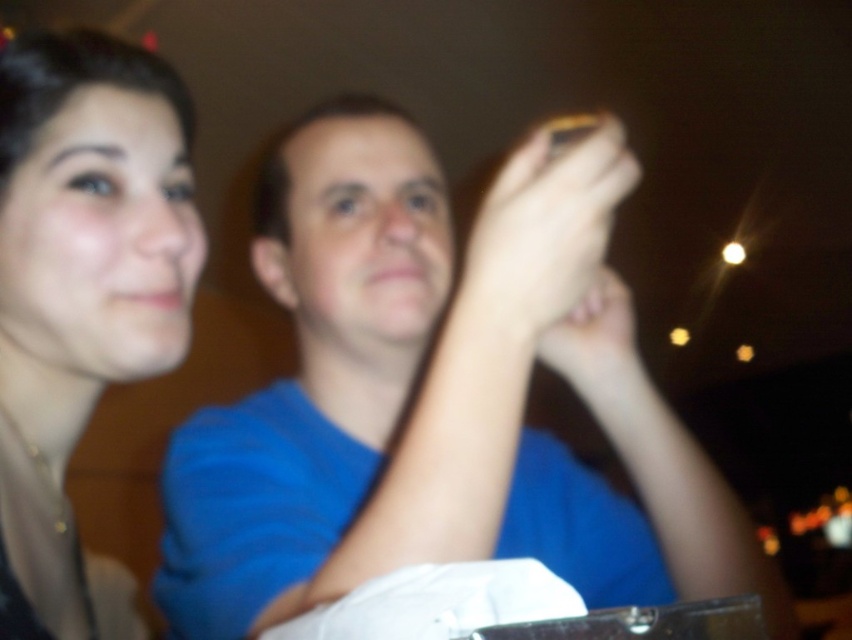
Question: Which is nearer to the smooth skin at upper center?

Choices:
 (A) yellow matte phone at upper center
 (B) blue matte shirt at center
 (C) matte black hair at upper left

Answer: (A)

Question: Among these objects, which one is nearest to the camera?

Choices:
 (A) blue matte shirt at center
 (B) smooth skin at upper center

Answer: (A)

Question: Among these points, which one is nearest to the camera?

Choices:
 (A) (586, 300)
 (B) (1, 339)
 (C) (562, 314)

Answer: (C)

Question: Does matte black hair at upper left have a lesser width compared to yellow matte phone at upper center?

Choices:
 (A) yes
 (B) no

Answer: (B)

Question: Is matte black hair at upper left closer to camera compared to smooth skin at upper center?

Choices:
 (A) no
 (B) yes

Answer: (B)

Question: Does blue matte shirt at center have a smaller size compared to yellow matte phone at upper center?

Choices:
 (A) yes
 (B) no

Answer: (B)